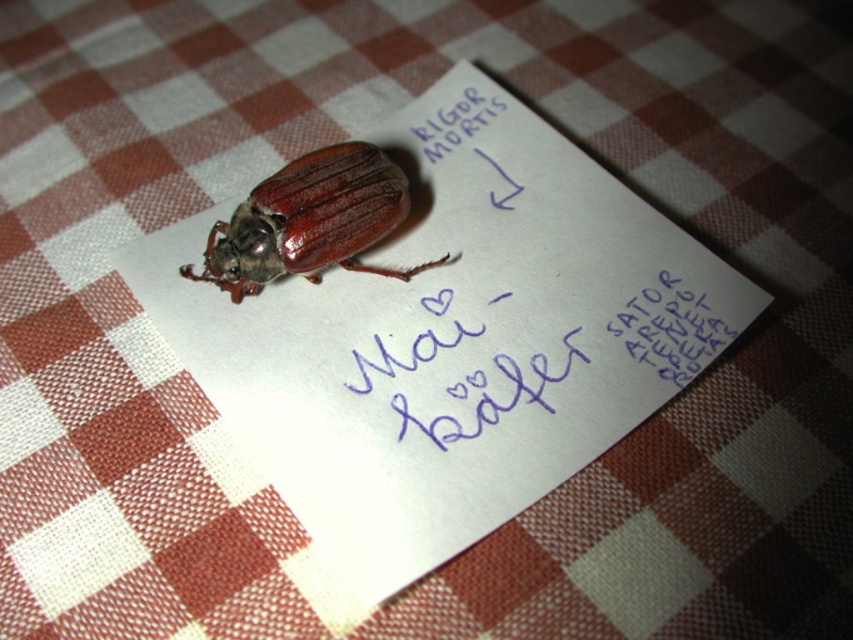
Question: Is the position of shiny brown beetle at center less distant than that of black paper at upper center?

Choices:
 (A) yes
 (B) no

Answer: (B)

Question: Which of these objects is positioned closest to the blue ink writing at center?

Choices:
 (A) shiny brown beetle at center
 (B) black paper at upper center

Answer: (B)

Question: Is shiny brown beetle at center to the right of black paper at upper center from the viewer's perspective?

Choices:
 (A) yes
 (B) no

Answer: (B)

Question: Which point is closer to the camera taking this photo?

Choices:
 (A) (498, 406)
 (B) (265, 220)
 (C) (688, 298)

Answer: (A)

Question: Considering the relative positions of shiny brown beetle at center and blue ink writing at center in the image provided, where is shiny brown beetle at center located with respect to blue ink writing at center?

Choices:
 (A) right
 (B) left

Answer: (B)

Question: Which is nearer to the black paper at upper center?

Choices:
 (A) shiny brown beetle at center
 (B) blue ink writing at center

Answer: (B)